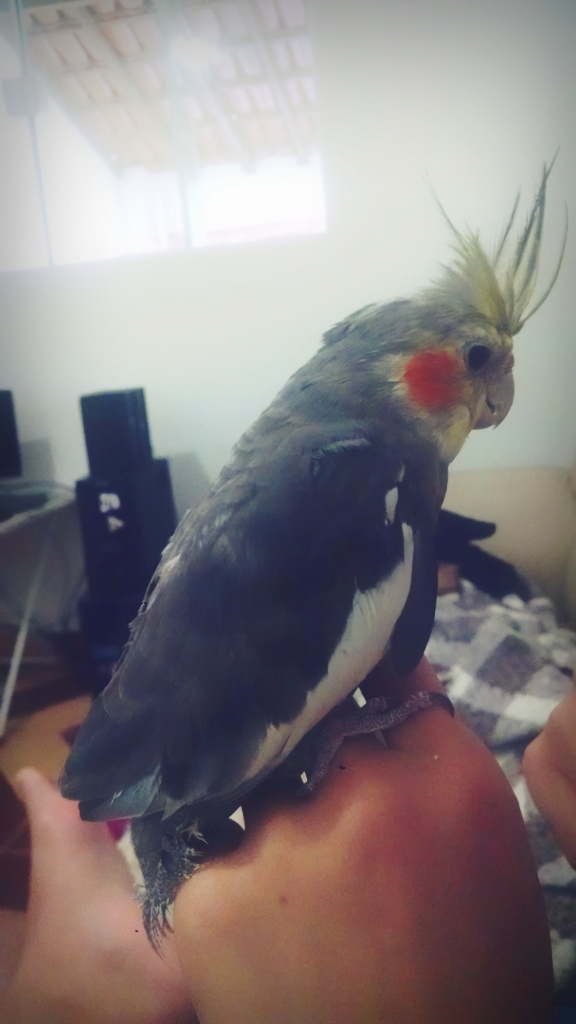
I want to click on cords, so click(x=48, y=483), click(x=60, y=614).